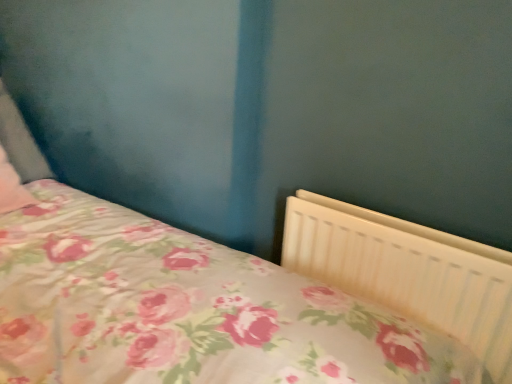
The height and width of the screenshot is (384, 512). What do you see at coordinates (20, 142) in the screenshot?
I see `pink floral fabric pillow at left` at bounding box center [20, 142].

What are the coordinates of `pink floral fabric pillow at left` in the screenshot? It's located at (20, 142).

Image resolution: width=512 pixels, height=384 pixels. What do you see at coordinates (407, 271) in the screenshot?
I see `white plastic radiator at lower right` at bounding box center [407, 271].

The height and width of the screenshot is (384, 512). Find the location of `white plastic radiator at lower right`. white plastic radiator at lower right is located at coordinates (407, 271).

Where is `pink floral fabric pillow at left`? The width and height of the screenshot is (512, 384). pink floral fabric pillow at left is located at coordinates (20, 142).

Can you confirm if pink floral fabric pillow at left is positioned to the right of white plastic radiator at lower right?

Incorrect, pink floral fabric pillow at left is not on the right side of white plastic radiator at lower right.

Which object is further away from the camera, pink floral fabric pillow at left or white plastic radiator at lower right?

pink floral fabric pillow at left.

Considering the positions of point (13, 101) and point (328, 229), is point (13, 101) closer or farther from the camera than point (328, 229)?

Clearly, point (13, 101) is more distant from the camera than point (328, 229).

From the image's perspective, is pink floral fabric pillow at left under white plastic radiator at lower right?

No, from the image's perspective, pink floral fabric pillow at left is not below white plastic radiator at lower right.

From a real-world perspective, is pink floral fabric pillow at left on white plastic radiator at lower right?

Yes, from a real-world perspective, pink floral fabric pillow at left is on top of white plastic radiator at lower right.

Looking at this image, which of these two, pink floral fabric pillow at left or white plastic radiator at lower right, is thinner?

white plastic radiator at lower right is thinner.

Which of these two, pink floral fabric pillow at left or white plastic radiator at lower right, stands taller?

white plastic radiator at lower right is taller.

Considering the relative sizes of pink floral fabric pillow at left and white plastic radiator at lower right in the image provided, is pink floral fabric pillow at left bigger than white plastic radiator at lower right?

Incorrect, pink floral fabric pillow at left is not larger than white plastic radiator at lower right.

Would you say pink floral fabric pillow at left contains white plastic radiator at lower right?

No, white plastic radiator at lower right is not surrounded by pink floral fabric pillow at left.

Are pink floral fabric pillow at left and white plastic radiator at lower right making contact?

They are not placed beside each other.

In the scene shown: Is pink floral fabric pillow at left looking in the opposite direction of white plastic radiator at lower right?

No, white plastic radiator at lower right is not at the back of pink floral fabric pillow at left.

You are a GUI agent. You are given a task and a screenshot of the screen. Output one action in this format:
    pyautogui.click(x=<x>, y=<y>)
    Task: Click on the pillow that is above the white plastic radiator at lower right (from the image's perspective)
    
    Given the screenshot: What is the action you would take?
    pyautogui.click(x=20, y=142)

Is white plastic radiator at lower right at the right side of pink floral fabric pillow at left?

Yes, white plastic radiator at lower right is to the right of pink floral fabric pillow at left.

Is white plastic radiator at lower right further to camera compared to pink floral fabric pillow at left?

No, it is not.

Which is in front, point (286, 223) or point (21, 143)?

The point (286, 223) is more forward.

From the image's perspective, is white plastic radiator at lower right located beneath pink floral fabric pillow at left?

Correct, white plastic radiator at lower right appears lower than pink floral fabric pillow at left in the image.

From a real-world perspective, is white plastic radiator at lower right physically below pink floral fabric pillow at left?

Indeed, from a real-world perspective, white plastic radiator at lower right is positioned beneath pink floral fabric pillow at left.

Considering the sizes of objects white plastic radiator at lower right and pink floral fabric pillow at left in the image provided, who is thinner, white plastic radiator at lower right or pink floral fabric pillow at left?

white plastic radiator at lower right.

Is white plastic radiator at lower right shorter than pink floral fabric pillow at left?

No, white plastic radiator at lower right is not shorter than pink floral fabric pillow at left.

Considering the sizes of white plastic radiator at lower right and pink floral fabric pillow at left in the image, is white plastic radiator at lower right bigger or smaller than pink floral fabric pillow at left?

Considering their sizes, white plastic radiator at lower right takes up more space than pink floral fabric pillow at left.

Is pink floral fabric pillow at left inside white plastic radiator at lower right?

No, pink floral fabric pillow at left is not surrounded by white plastic radiator at lower right.

Consider the image. Is white plastic radiator at lower right directly adjacent to pink floral fabric pillow at left?

No, white plastic radiator at lower right is not with pink floral fabric pillow at left.

Is pink floral fabric pillow at left at the back of white plastic radiator at lower right?

That's not correct — white plastic radiator at lower right is not looking away from pink floral fabric pillow at left.

Can you tell me how much white plastic radiator at lower right and pink floral fabric pillow at left differ in facing direction?

white plastic radiator at lower right and pink floral fabric pillow at left are facing 90.2 degrees away from each other.

Image resolution: width=512 pixels, height=384 pixels. In order to click on pillow on the left of the white plastic radiator at lower right in this screenshot , I will do `click(20, 142)`.

Identify the location of pillow above the white plastic radiator at lower right (from the image's perspective). This screenshot has width=512, height=384. (20, 142).

The width and height of the screenshot is (512, 384). Find the location of `pillow above the white plastic radiator at lower right (from a real-world perspective)`. pillow above the white plastic radiator at lower right (from a real-world perspective) is located at coordinates (20, 142).